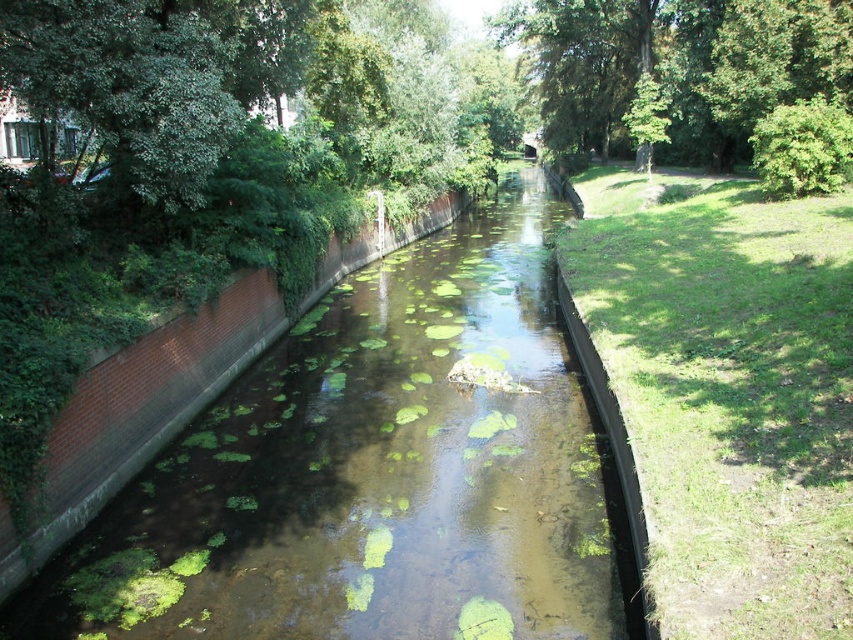
Question: Which of the following is the farthest from the observer?

Choices:
 (A) (143, 8)
 (B) (701, 67)
 (C) (724, 364)

Answer: (B)

Question: Is green algae-covered water at center smaller than green leafy tree at upper left?

Choices:
 (A) yes
 (B) no

Answer: (B)

Question: Which point is farther to the camera?

Choices:
 (A) (837, 381)
 (B) (624, 20)
 (C) (422, 548)

Answer: (B)

Question: Which point is farther from the camera taking this photo?

Choices:
 (A) (531, 467)
 (B) (97, 80)

Answer: (A)

Question: Where is green grass at right located in relation to green leafy tree at upper center in the image?

Choices:
 (A) left
 (B) right

Answer: (A)

Question: Is green algae-covered water at center below green leafy tree at upper center?

Choices:
 (A) yes
 (B) no

Answer: (A)